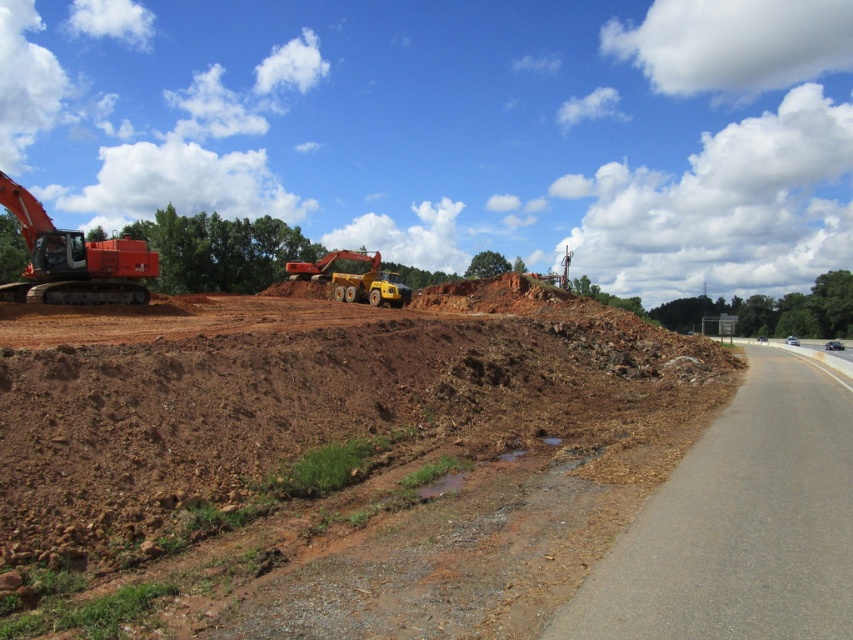
Based on the photo, you are a delivery truck driver who needs to pass through the construction site. Your truck is 15 meters long. You see the brown soil at lower left and the orange metallic excavator at left. Can you safely navigate your truck between them?

The brown soil at lower left and the orange metallic excavator at left are 14.92 meters apart from each other. Since your truck is 15 meters long, it is slightly longer than the gap between them. Therefore, you cannot safely navigate your truck between them.

You are a delivery truck driver approaching the construction site. You need to determine which point, point 1 at coordinates (184, 614) or point 2 at coordinates (68, 280), is closer to the road edge marked by the solid white line. Based on the scene, which point is closer?

Point 1 at coordinates (184, 614) is in front of point 2 at coordinates (68, 280), so it is closer to the road edge marked by the solid white line.